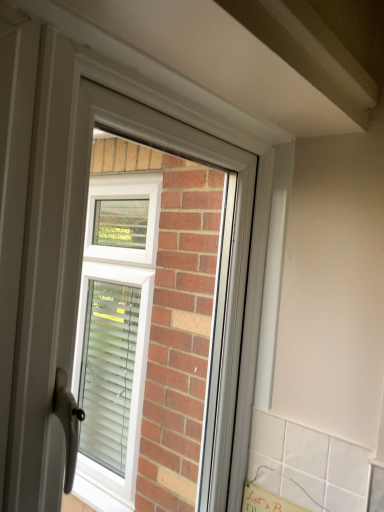
What do you see at coordinates (232, 242) in the screenshot? I see `white plastic window at center` at bounding box center [232, 242].

What are the coordinates of `white plastic window at center` in the screenshot? It's located at (232, 242).

Locate an element on the screen. white plastic window at center is located at coordinates (x=232, y=242).